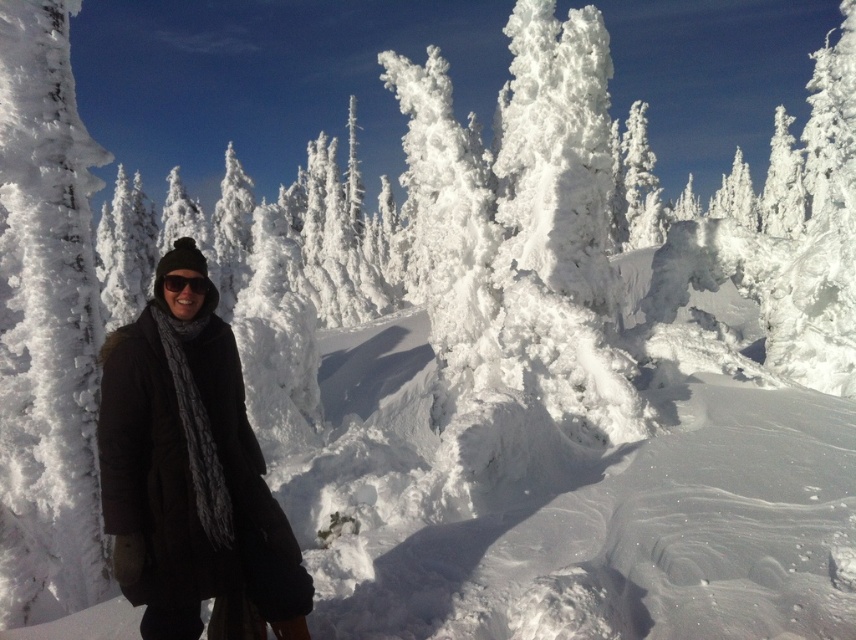
You are a fashion designer analyzing the winter scene. You notice the black woolen coat at center and the black matte sunglasses at center. How far apart are these two items in inches?

The distance between the black woolen coat at center and the black matte sunglasses at center is 10.85 inches.

You are a photographer trying to capture the white frosty tree at upper right and the black matte sunglasses at center in a single shot. Which object should you focus on first to ensure both are in focus?

You should focus on the white frosty tree at upper right first because it is closer to you than the black matte sunglasses at center, so focusing on the closer object will help ensure both are in focus.